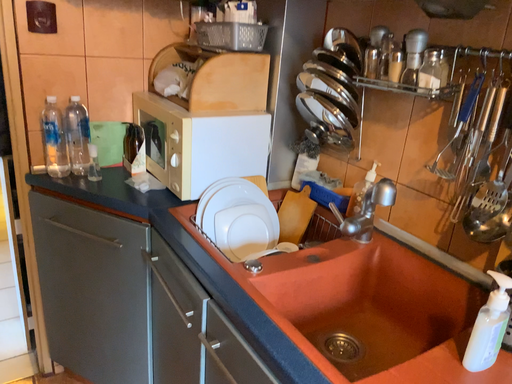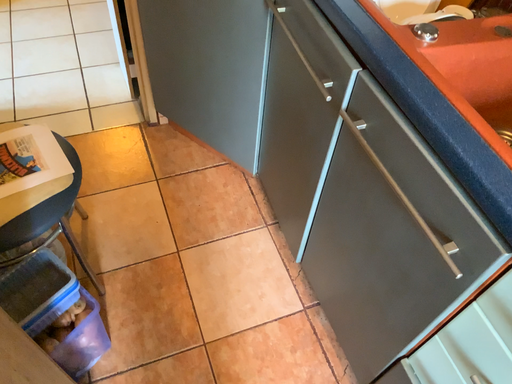
Question: Which way did the camera rotate in the video?

Choices:
 (A) rotated upward
 (B) rotated downward

Answer: (B)